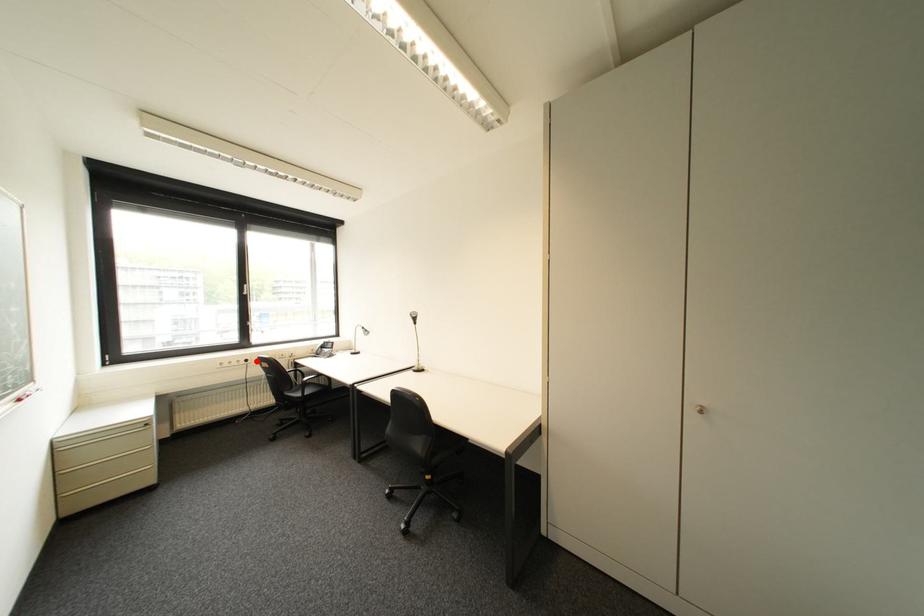
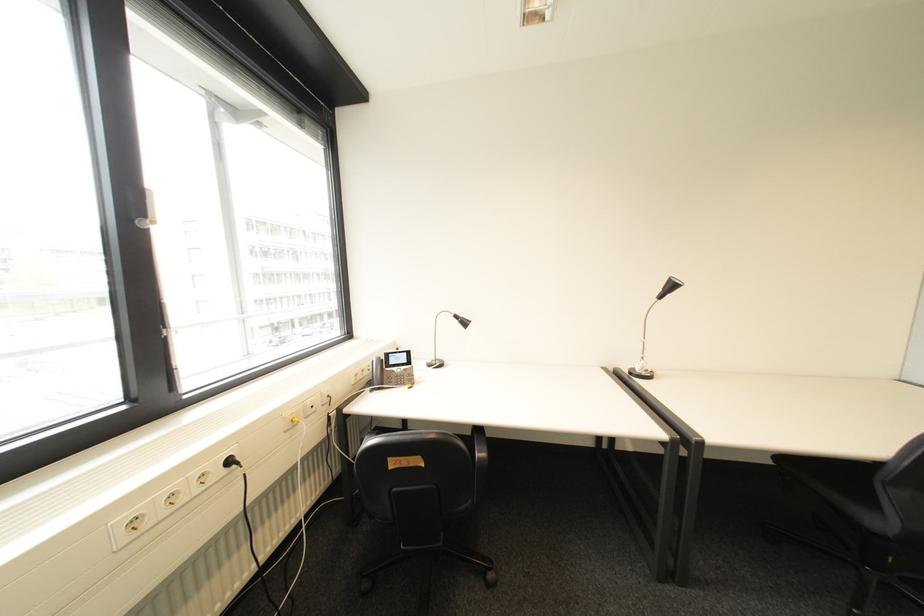
Where in the second image is the point corresponding to the highlighted location from the first image?

(239, 463)